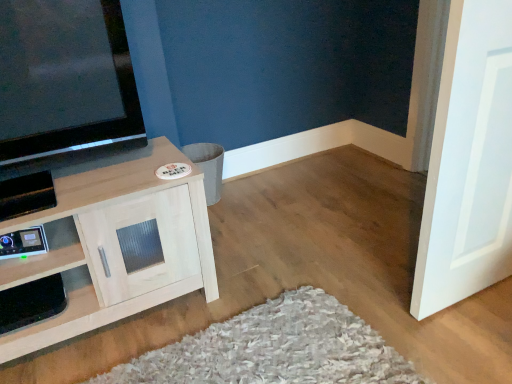
Question: From a real-world perspective, relative to white matte door at right, is light wood cabinet at left vertically above or below?

Choices:
 (A) above
 (B) below

Answer: (B)

Question: Relative to white matte door at right, is light wood cabinet at left in front or behind?

Choices:
 (A) behind
 (B) front

Answer: (A)

Question: From their relative heights in the image, would you say light wood cabinet at left is taller or shorter than white matte door at right?

Choices:
 (A) short
 (B) tall

Answer: (A)

Question: Is white matte door at right in front of or behind light wood cabinet at left in the image?

Choices:
 (A) behind
 (B) front

Answer: (B)

Question: Looking at their shapes, would you say white matte door at right is wider or thinner than light wood cabinet at left?

Choices:
 (A) wide
 (B) thin

Answer: (B)

Question: From the image's perspective, is white matte door at right located above or below light wood cabinet at left?

Choices:
 (A) below
 (B) above

Answer: (B)

Question: In the image, is white matte door at right on the left side or the right side of light wood cabinet at left?

Choices:
 (A) right
 (B) left

Answer: (A)